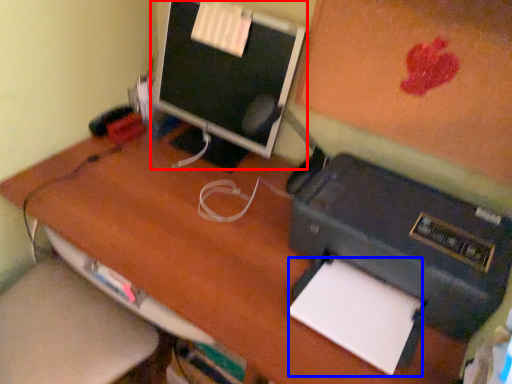
Question: Which point is further to the camera, computer monitor (highlighted by a red box) or notepad (highlighted by a blue box)?

Choices:
 (A) computer monitor
 (B) notepad

Answer: (A)